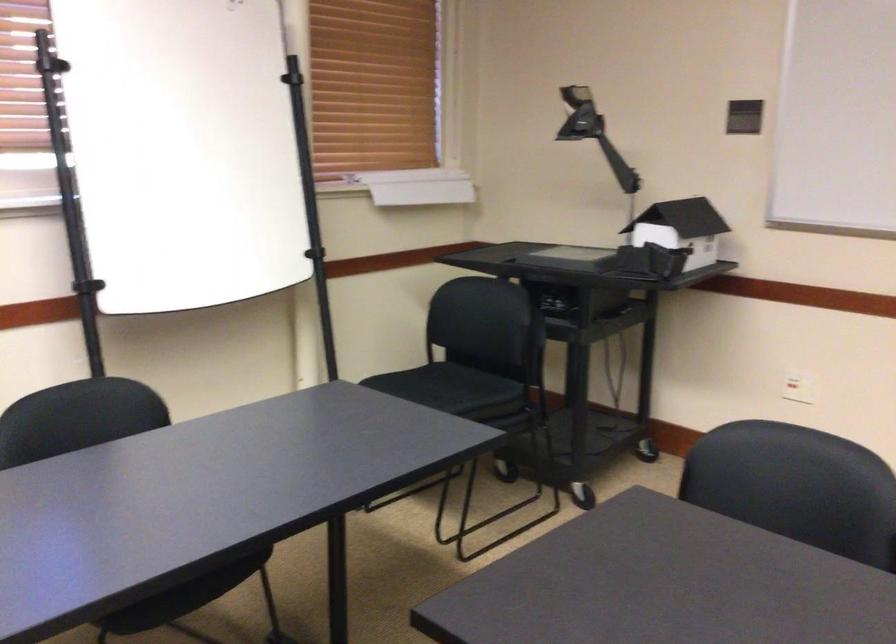
Describe the element at coordinates (579, 115) in the screenshot. The image size is (896, 644). I see `a projector arm` at that location.